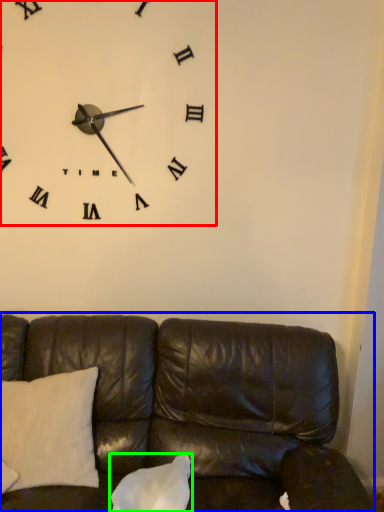
Question: Considering the real-world distances, which object is closest to wall clock (highlighted by a red box)? studio couch (highlighted by a blue box) or pillow (highlighted by a green box).

Choices:
 (A) studio couch
 (B) pillow

Answer: (A)